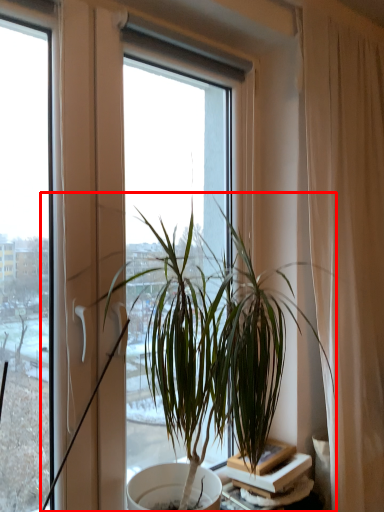
Question: From the image, what is the correct spatial relationship of houseplant (annotated by the red box) in relation to table?

Choices:
 (A) right
 (B) left

Answer: (B)